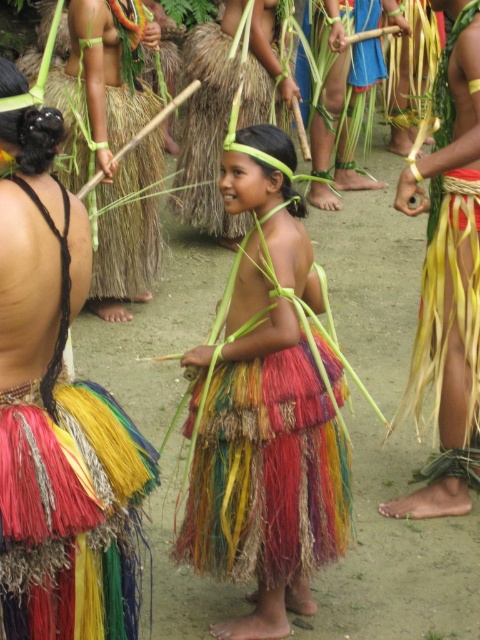
Is multicolored grass skirt at center above multicolored woven skirt at center?

Incorrect, multicolored grass skirt at center is not positioned above multicolored woven skirt at center.

Describe the element at coordinates (265, 465) in the screenshot. I see `multicolored grass skirt at center` at that location.

Find the location of a particular element. This screenshot has width=480, height=640. multicolored grass skirt at center is located at coordinates (265, 465).